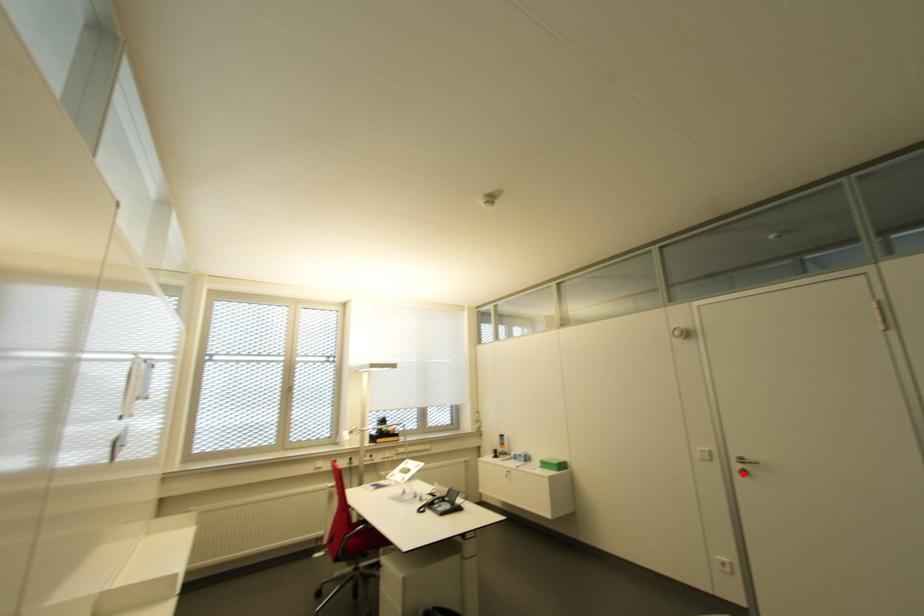
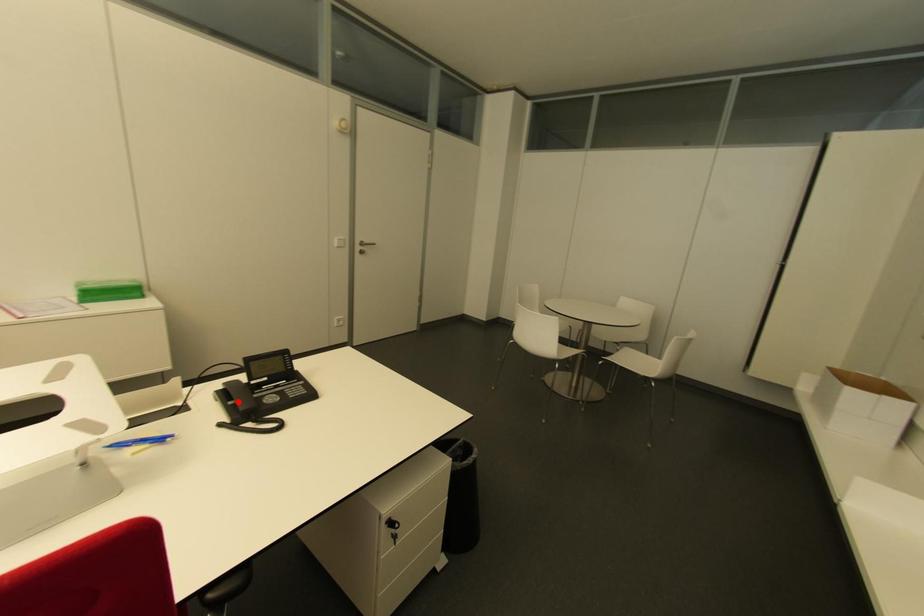
I am providing you with two images of the same scene from different viewpoints. A red point is marked on the first image and another point is marked on the second image. Is the red point in image1 aligned with the point shown in image2?

No